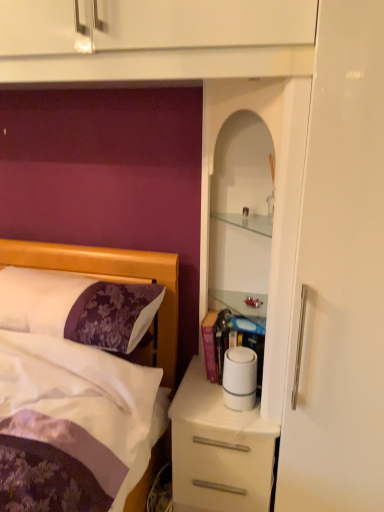
Where is `purple satin pillow at left`? Image resolution: width=384 pixels, height=512 pixels. purple satin pillow at left is located at coordinates (78, 307).

What's the angular difference between purple satin pillow at left and white glossy cabinet at upper right's facing directions?

The facing directions of purple satin pillow at left and white glossy cabinet at upper right are 0.305 degrees apart.

Is white glossy cabinet at upper right surrounded by purple satin pillow at left?

No, white glossy cabinet at upper right is not a part of purple satin pillow at left.

This screenshot has height=512, width=384. What are the coordinates of `pillow that appears below the white glossy cabinet at upper right (from a real-world perspective)` in the screenshot? It's located at (78, 307).

Considering the sizes of purple satin pillow at left and white glossy cabinet at upper right in the image, is purple satin pillow at left taller or shorter than white glossy cabinet at upper right?

In the image, purple satin pillow at left appears to be shorter than white glossy cabinet at upper right.

Can you confirm if white glossy cabinet at upper right is positioned to the left of white glossy desk at center?

No, white glossy cabinet at upper right is not to the left of white glossy desk at center.

Are white glossy cabinet at upper right and white glossy desk at center making contact?

There is a gap between white glossy cabinet at upper right and white glossy desk at center.

Does white glossy cabinet at upper right lie in front of white glossy desk at center?

Yes, the depth of white glossy cabinet at upper right is less than that of white glossy desk at center.

From a real-world perspective, which is physically below, white glossy cabinet at upper right or white glossy desk at center?

In real-world perspective, white glossy desk at center is lower.

Looking at this image, from their relative heights in the image, would you say white matte toilet paper at center is taller or shorter than white glossy cabinet at upper right?

Clearly, white matte toilet paper at center is shorter compared to white glossy cabinet at upper right.

Between white matte toilet paper at center and white glossy cabinet at upper right, which one has larger width?

With larger width is white glossy cabinet at upper right.

Is white matte toilet paper at center situated inside white glossy cabinet at upper right or outside?

white matte toilet paper at center is contained in white glossy cabinet at upper right.

Between white matte toilet paper at center and white glossy cabinet at upper right, which one is positioned behind?

Positioned behind is white matte toilet paper at center.

How much distance is there between white glossy desk at center and white glossy cabinet at upper right?

white glossy desk at center and white glossy cabinet at upper right are 15.35 inches apart from each other.

Can you confirm if white glossy desk at center is bigger than white glossy cabinet at upper right?

Incorrect, white glossy desk at center is not larger than white glossy cabinet at upper right.

Is white glossy desk at center inside or outside of white glossy cabinet at upper right?

The correct answer is: outside.

From the image's perspective, which one is positioned lower, white glossy desk at center or white glossy cabinet at upper right?

white glossy desk at center appears lower in the image.

From a real-world perspective, is purple satin pillow at left above or below white matte toilet paper at center?

purple satin pillow at left is situated higher than white matte toilet paper at center in the real world.

Can you tell me how much purple satin pillow at left and white matte toilet paper at center differ in facing direction?

There is a 0.619-degree angle between the facing directions of purple satin pillow at left and white matte toilet paper at center.

From the image's perspective, which one is positioned lower, purple satin pillow at left or white matte toilet paper at center?

white matte toilet paper at center appears lower in the image.

Does purple satin pillow at left have a greater height compared to white matte toilet paper at center?

Correct, purple satin pillow at left is much taller as white matte toilet paper at center.

Between purple satin pillow at left and white glossy desk at center, which one appears on the right side from the viewer's perspective?

white glossy desk at center is more to the right.

I want to click on desk located on the right of purple satin pillow at left, so click(218, 449).

Do you think purple satin pillow at left is within white glossy desk at center, or outside of it?

purple satin pillow at left is spatially situated outside white glossy desk at center.

From the image's perspective, would you say purple satin pillow at left is positioned over white glossy desk at center?

Yes.

From the picture: Would you consider white glossy cabinet at upper right to be distant from purple satin pillow at left?

No, white glossy cabinet at upper right is not far from purple satin pillow at left.

Image resolution: width=384 pixels, height=512 pixels. Find the location of `cabinet above the purple satin pillow at left (from the image's perspective)`. cabinet above the purple satin pillow at left (from the image's perspective) is located at coordinates (275, 201).

Is white glossy cabinet at upper right looking in the opposite direction of purple satin pillow at left?

No, white glossy cabinet at upper right is not facing away from purple satin pillow at left.

From the image's perspective, which one is positioned lower, white glossy cabinet at upper right or purple satin pillow at left?

purple satin pillow at left is shown below in the image.

Identify the location of cabinet above the purple satin pillow at left (from a real-world perspective). Image resolution: width=384 pixels, height=512 pixels. (275, 201).

The width and height of the screenshot is (384, 512). In order to click on desk behind the white glossy cabinet at upper right in this screenshot , I will do `click(218, 449)`.

When comparing their distances from purple satin pillow at left, does white matte toilet paper at center or white glossy cabinet at upper right seem closer?

white matte toilet paper at center is closer to purple satin pillow at left.

Based on the photo, considering their positions, is white glossy desk at center positioned further to white glossy cabinet at upper right than white matte toilet paper at center?

white glossy desk at center.

When comparing their distances from white glossy cabinet at upper right, does purple satin pillow at left or white glossy desk at center seem further?

purple satin pillow at left is positioned further to the anchor white glossy cabinet at upper right.

Based on their spatial positions, is purple satin pillow at left or white glossy cabinet at upper right closer to white glossy desk at center?

The object closer to white glossy desk at center is white glossy cabinet at upper right.

Estimate the real-world distances between objects in this image. Which object is further from white matte toilet paper at center, white glossy cabinet at upper right or purple satin pillow at left?

Among the two, purple satin pillow at left is located further to white matte toilet paper at center.

Estimate the real-world distances between objects in this image. Which object is closer to white matte toilet paper at center, white glossy desk at center or white glossy cabinet at upper right?

white glossy desk at center lies closer to white matte toilet paper at center than the other object.

Looking at the image, which one is located closer to white glossy desk at center, white matte toilet paper at center or purple satin pillow at left?

The object closer to white glossy desk at center is white matte toilet paper at center.

Estimate the real-world distances between objects in this image. Which object is further from white glossy desk at center, purple satin pillow at left or white matte toilet paper at center?

purple satin pillow at left is further to white glossy desk at center.

What are the coordinates of `desk located between purple satin pillow at left and white matte toilet paper at center in the left-right direction` in the screenshot? It's located at (218, 449).

Locate an element on the screen. pillow between white glossy cabinet at upper right and white glossy desk at center from top to bottom is located at coordinates (78, 307).

The width and height of the screenshot is (384, 512). I want to click on cabinet between purple satin pillow at left and white matte toilet paper at center from left to right, so click(x=275, y=201).

Find the location of a particular element. toilet paper that lies between white glossy cabinet at upper right and white glossy desk at center from top to bottom is located at coordinates (240, 378).